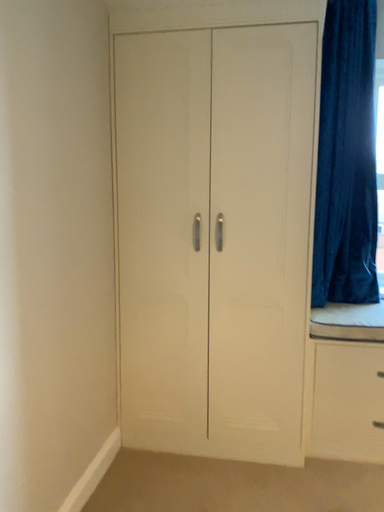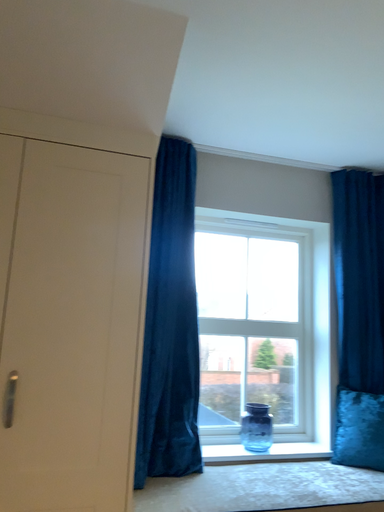
Question: How did the camera likely rotate when shooting the video?

Choices:
 (A) rotated left
 (B) rotated right

Answer: (B)